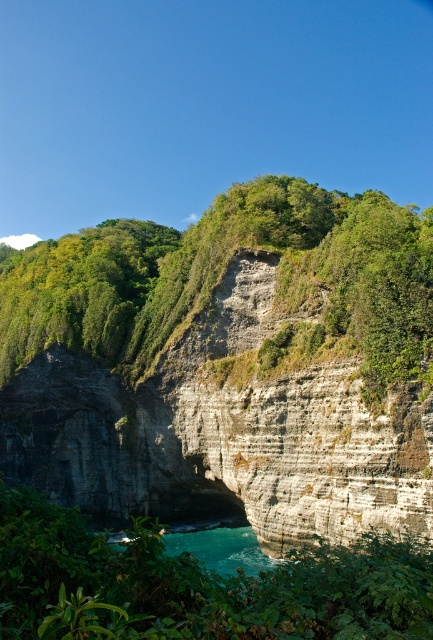
Is green leafy vegetation at lower center to the right of turquoise glossy water at lower center from the viewer's perspective?

Indeed, green leafy vegetation at lower center is positioned on the right side of turquoise glossy water at lower center.

Is green leafy vegetation at lower center smaller than turquoise glossy water at lower center?

No, green leafy vegetation at lower center is not smaller than turquoise glossy water at lower center.

Find the location of a particular element. The image size is (433, 640). green leafy vegetation at lower center is located at coordinates point(196,586).

The height and width of the screenshot is (640, 433). Find the location of `green leafy vegetation at lower center`. green leafy vegetation at lower center is located at coordinates (196, 586).

Can you confirm if green leafy vegetation at center is smaller than turquoise glossy water at lower center?

No, green leafy vegetation at center is not smaller than turquoise glossy water at lower center.

Does green leafy vegetation at center lie in front of turquoise glossy water at lower center?

That is False.

Is point (384, 380) more distant than point (255, 554)?

No, (384, 380) is closer to viewer.

This screenshot has height=640, width=433. What are the coordinates of `green leafy vegetation at center` in the screenshot? It's located at (222, 273).

Find the location of `green leafy vegetation at center`. green leafy vegetation at center is located at coordinates (222, 273).

Image resolution: width=433 pixels, height=640 pixels. What do you see at coordinates (222, 273) in the screenshot?
I see `green leafy vegetation at center` at bounding box center [222, 273].

Locate an element on the screen. The width and height of the screenshot is (433, 640). green leafy vegetation at center is located at coordinates pyautogui.click(x=222, y=273).